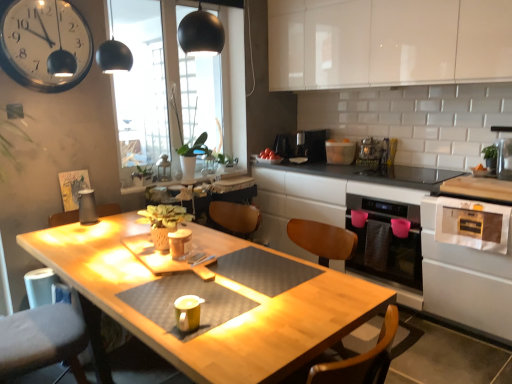
Locate an element on the screen. This screenshot has height=384, width=512. vacant space that is to the left of matte plastic container at center, which appears as the 7th appliance when viewed from the back is located at coordinates point(152,256).